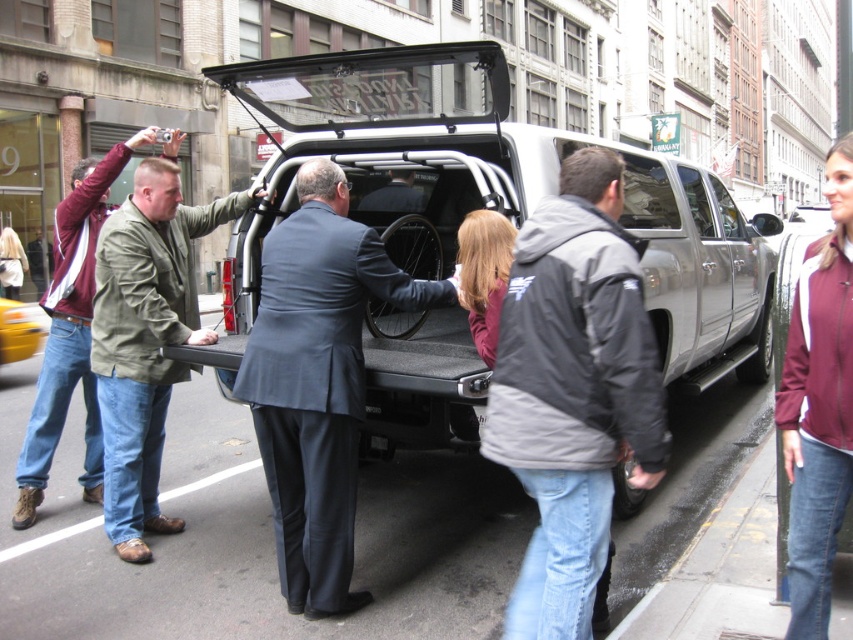
Question: Which is farther from the yellow matte taxi at left?

Choices:
 (A) gray fleece jacket at center
 (B) green matte jacket at left

Answer: (B)

Question: Does gray fleece jacket at center appear on the right side of green matte jacket at left?

Choices:
 (A) no
 (B) yes

Answer: (B)

Question: Can you confirm if white matte truck bed at center is positioned to the left of dark blue suit at center?

Choices:
 (A) no
 (B) yes

Answer: (B)

Question: Which point is farther to the camera?

Choices:
 (A) dark blue suit at center
 (B) burgundy fabric jacket at lower right
 (C) green canvas jacket at left

Answer: (C)

Question: Which point is closer to the camera?

Choices:
 (A) white matte truck bed at center
 (B) gray fleece jacket at center

Answer: (B)

Question: Can you confirm if gray fleece jacket at center is positioned below burgundy fabric jacket at lower right?

Choices:
 (A) no
 (B) yes

Answer: (B)